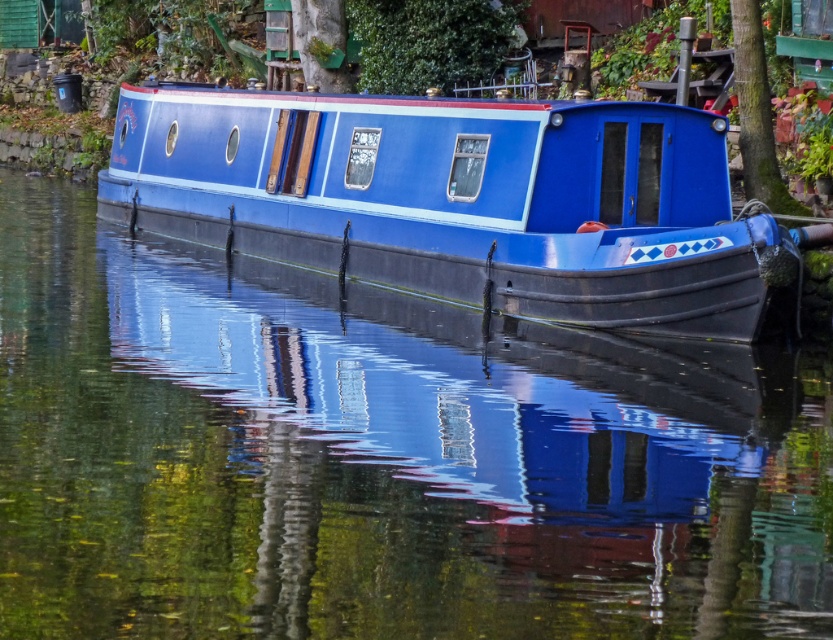
Can you confirm if transparent glass water at center is positioned below green rough bark tree at upper right?

Indeed, transparent glass water at center is positioned under green rough bark tree at upper right.

Between transparent glass water at center and green rough bark tree at upper right, which one is positioned lower?

transparent glass water at center

Find the location of `transparent glass water at center`. transparent glass water at center is located at coordinates (377, 460).

Is blue glossy boat at center to the left of green rough bark tree at upper right from the viewer's perspective?

Indeed, blue glossy boat at center is positioned on the left side of green rough bark tree at upper right.

The image size is (833, 640). What are the coordinates of `blue glossy boat at center` in the screenshot? It's located at (460, 198).

Is point (569, 401) farther from viewer compared to point (337, 170)?

No, it is in front of (337, 170).

Is transparent glass water at center closer to the viewer compared to blue glossy boat at center?

Yes, it is in front of blue glossy boat at center.

Does point (198, 269) come closer to viewer compared to point (338, 115)?

That is False.

The height and width of the screenshot is (640, 833). In order to click on transparent glass water at center in this screenshot , I will do `click(377, 460)`.